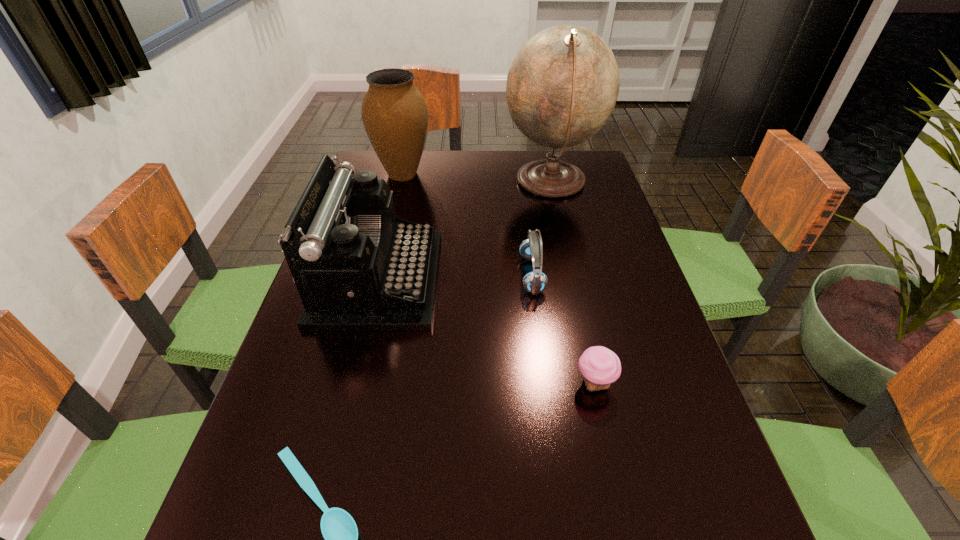
Find the location of a particular element. The image size is (960, 540). vacant space located on the typing side of the third tallest object is located at coordinates (537, 279).

Image resolution: width=960 pixels, height=540 pixels. Identify the location of vacant space located 0.330m on the ear cups of the third shortest object. (379, 274).

In order to click on vacant space located 0.360m on the ear cups of the third shortest object in this screenshot , I will do `click(366, 274)`.

What are the coordinates of `free spot located 0.300m on the ear cups of the third shortest object` in the screenshot? It's located at (392, 274).

At what (x,y) coordinates should I click in order to perform the action: click on free space located 0.230m on the left of the cupcake. Please return your answer as a coordinate pair (x, y). The height and width of the screenshot is (540, 960). Looking at the image, I should click on (450, 383).

At what (x,y) coordinates should I click in order to perform the action: click on globe present at the far edge. Please return your answer as a coordinate pair (x, y). Image resolution: width=960 pixels, height=540 pixels. Looking at the image, I should click on click(x=562, y=86).

You are a GUI agent. You are given a task and a screenshot of the screen. Output one action in this format:
    pyautogui.click(x=<x>, y=<y>)
    Task: Click on the urn situated at the far edge
    
    Given the screenshot: What is the action you would take?
    pyautogui.click(x=394, y=113)

Identify the location of urn located at the left edge. The width and height of the screenshot is (960, 540). (394, 113).

Locate an element on the screen. typewriter located at the left edge is located at coordinates (358, 267).

Identify the location of globe that is at the right edge. The width and height of the screenshot is (960, 540). (562, 86).